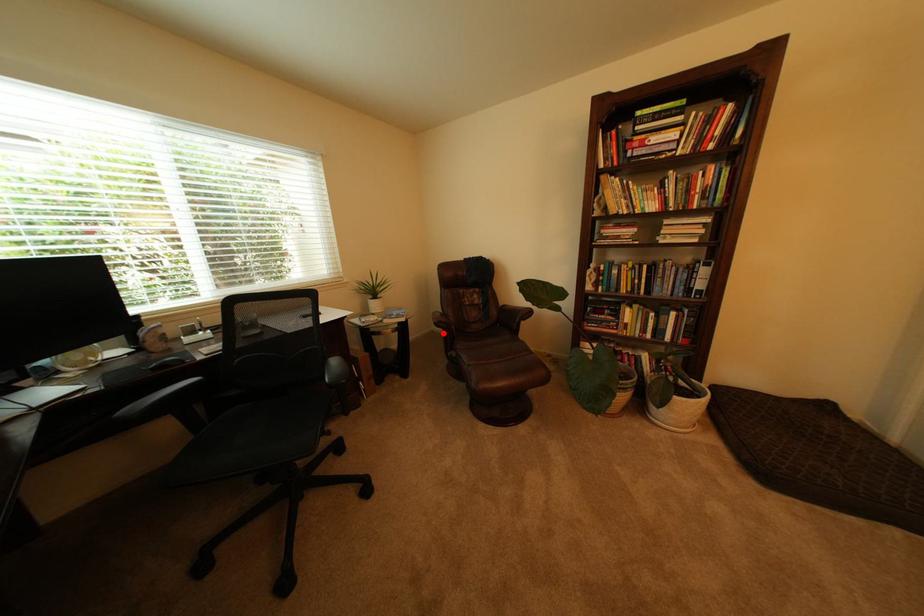
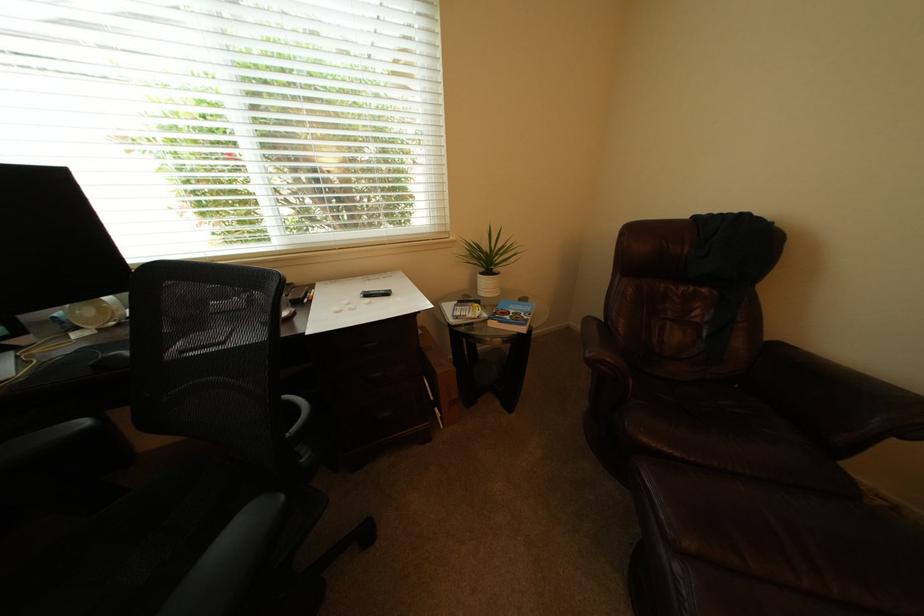
Question: I am providing you with two images of the same scene from different viewpoints. In image1, a red point is highlighted. Considering the same 3D point in image2, which of the following is correct?

Choices:
 (A) It is closer
 (B) It is farther

Answer: (A)